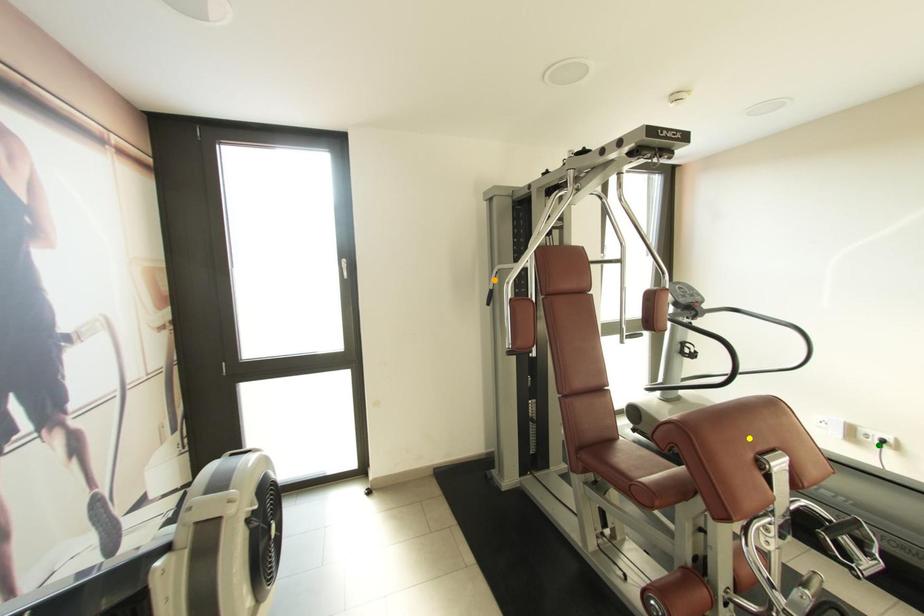
Order these from nearest to farthest:
orange point
green point
yellow point

yellow point, green point, orange point